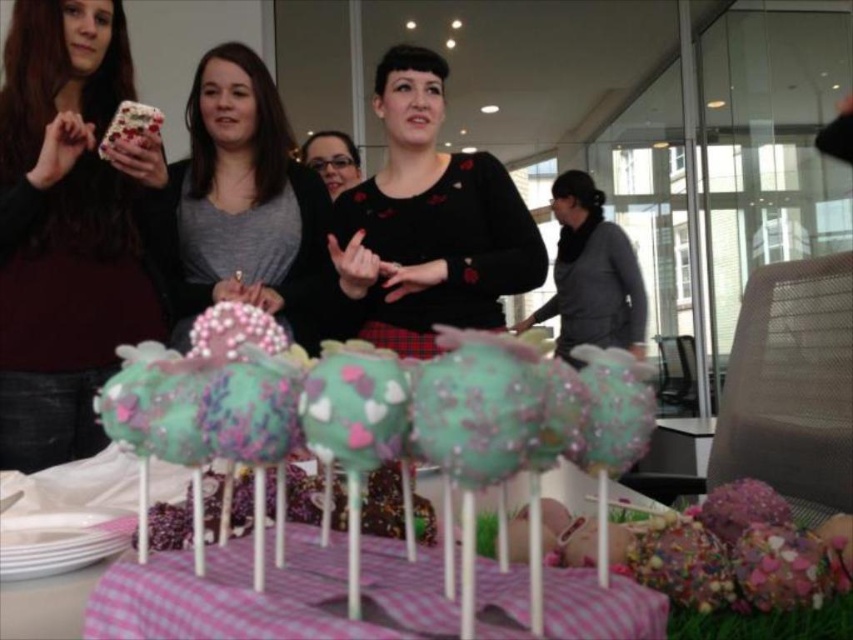
Question: Does black matte sweater at center have a larger size compared to matte black glasses at center?

Choices:
 (A) no
 (B) yes

Answer: (B)

Question: Based on their relative distances, which object is nearer to the matte gray sweater at center?

Choices:
 (A) pink checkered fabric at center
 (B) gray matte jacket at center

Answer: (A)

Question: Is the position of gray matte jacket at center more distant than that of matte black glasses at center?

Choices:
 (A) yes
 (B) no

Answer: (A)

Question: Estimate the real-world distances between objects in this image. Which object is farther from the black matte sweater at center?

Choices:
 (A) matte black glasses at center
 (B) matte black sweater at upper left
 (C) matte gray sweater at center
 (D) pink checkered fabric at center

Answer: (D)

Question: Considering the real-world distances, which object is closest to the matte gray sweater at center?

Choices:
 (A) black matte sweater at center
 (B) gray matte jacket at center

Answer: (A)

Question: Is black matte sweater at center behind glittery pink phone case at upper left?

Choices:
 (A) yes
 (B) no

Answer: (A)